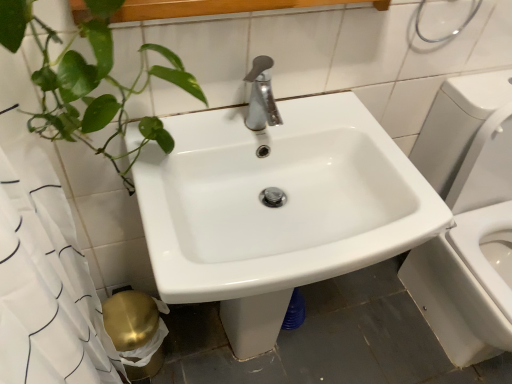
Describe the element at coordinates (276, 208) in the screenshot. I see `white glossy sink at center` at that location.

I want to click on white glossy sink at center, so click(x=276, y=208).

In order to face white paper at lower left, should I rotate leftwards or rightwards?

A 14.785 degree turn to the left will do.

Measure the distance between white paper at lower left and camera.

white paper at lower left and camera are 1.12 meters apart.

This screenshot has height=384, width=512. Describe the element at coordinates (135, 331) in the screenshot. I see `white paper at lower left` at that location.

Find the location of `white paper at lower left`. white paper at lower left is located at coordinates (135, 331).

The image size is (512, 384). Find the location of `white glossy sink at center`. white glossy sink at center is located at coordinates (276, 208).

Does white paper at lower left appear on the right side of white glossy sink at center?

Incorrect, white paper at lower left is not on the right side of white glossy sink at center.

Considering their positions, is white paper at lower left located in front of or behind white glossy sink at center?

white paper at lower left is behind white glossy sink at center.

Which point is more distant from viewer, (129, 334) or (309, 243)?

Point (129, 334)

From the image's perspective, which one is positioned lower, white paper at lower left or white glossy sink at center?

white paper at lower left appears lower in the image.

From a real-world perspective, is white paper at lower left above or below white glossy sink at center?

From a real-world perspective, white paper at lower left is physically below white glossy sink at center.

Is white paper at lower left wider or thinner than white glossy sink at center?

Considering their sizes, white paper at lower left looks slimmer than white glossy sink at center.

From their relative heights in the image, would you say white paper at lower left is taller or shorter than white glossy sink at center?

In the image, white paper at lower left appears to be shorter than white glossy sink at center.

Can you confirm if white paper at lower left is smaller than white glossy sink at center?

Correct, white paper at lower left occupies less space than white glossy sink at center.

Is white paper at lower left located outside white glossy sink at center?

Yes.

Is white paper at lower left placed right next to white glossy sink at center?

They are not placed beside each other.

Is white paper at lower left aimed at white glossy sink at center?

No, white paper at lower left is not oriented towards white glossy sink at center.

How many degrees apart are the facing directions of white paper at lower left and white glossy sink at center?

They differ by 2.04 degrees in their facing directions.

At what (x,y) coordinates should I click in order to perform the action: click on toilet paper below the white glossy sink at center (from a real-world perspective). Please return your answer as a coordinate pair (x, y). This screenshot has width=512, height=384. Looking at the image, I should click on (135, 331).

Can you confirm if white glossy sink at center is positioned to the right of white paper at lower left?

Correct, you'll find white glossy sink at center to the right of white paper at lower left.

Considering the relative positions of white glossy sink at center and white paper at lower left in the image provided, is white glossy sink at center behind white paper at lower left?

No, white glossy sink at center is closer to the viewer.

Is point (253, 180) farther from viewer compared to point (134, 360)?

That is False.

From the image's perspective, is white glossy sink at center on white paper at lower left?

Yes, from the image's perspective, white glossy sink at center is over white paper at lower left.

From a real-world perspective, is white glossy sink at center above or below white paper at lower left?

white glossy sink at center is situated higher than white paper at lower left in the real world.

Is white glossy sink at center wider than white paper at lower left?

Yes, white glossy sink at center is wider than white paper at lower left.

Is white glossy sink at center taller than white paper at lower left?

Yes, white glossy sink at center is taller than white paper at lower left.

Is white glossy sink at center smaller than white paper at lower left?

No, white glossy sink at center is not smaller than white paper at lower left.

Is white glossy sink at center inside or outside of white paper at lower left?

white glossy sink at center is located beyond the bounds of white paper at lower left.

Would you consider white glossy sink at center to be distant from white paper at lower left?

white glossy sink at center is near white paper at lower left, not far away.

Could you tell me if white glossy sink at center is facing white paper at lower left?

No, white glossy sink at center is not aimed at white paper at lower left.

How many degrees apart are the facing directions of white glossy sink at center and white paper at lower left?

There is a 2.04-degree angle between the facing directions of white glossy sink at center and white paper at lower left.

You are a GUI agent. You are given a task and a screenshot of the screen. Output one action in this format:
    pyautogui.click(x=<x>, y=<y>)
    Task: Click on the sink above the white paper at lower left (from the image's perspective)
    
    Given the screenshot: What is the action you would take?
    pyautogui.click(x=276, y=208)

Locate an element on the screen. toilet paper to the left of white glossy sink at center is located at coordinates (135, 331).

Where is `sink above the white paper at lower left (from the image's perspective)`? This screenshot has height=384, width=512. sink above the white paper at lower left (from the image's perspective) is located at coordinates (276, 208).